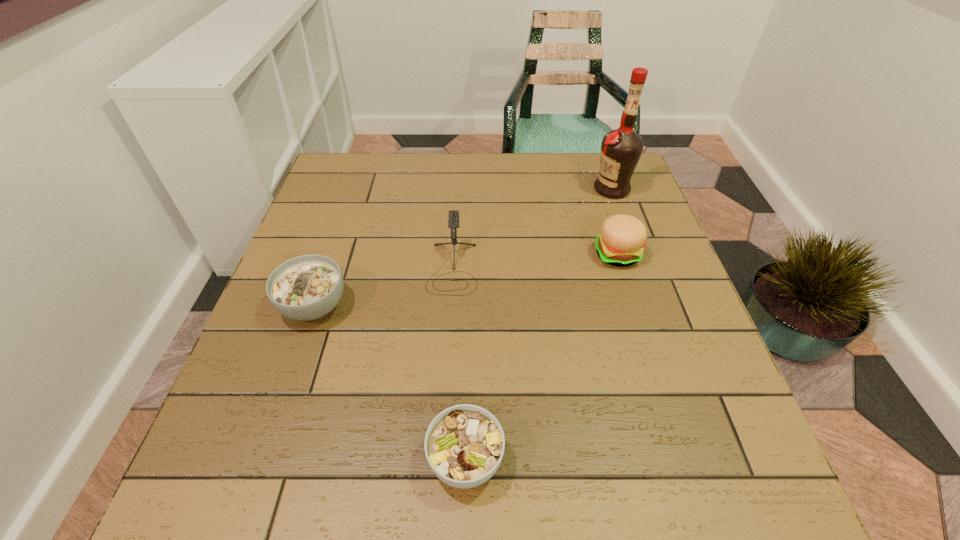
At what (x,y) coordinates should I click in order to perform the action: click on vacant position in the image that satisfies the following two spatial constraints: 1. on the stand of the microphone; 2. on the left side of the shorter soup bowl. Please return your answer as a coordinate pair (x, y). Looking at the image, I should click on (441, 460).